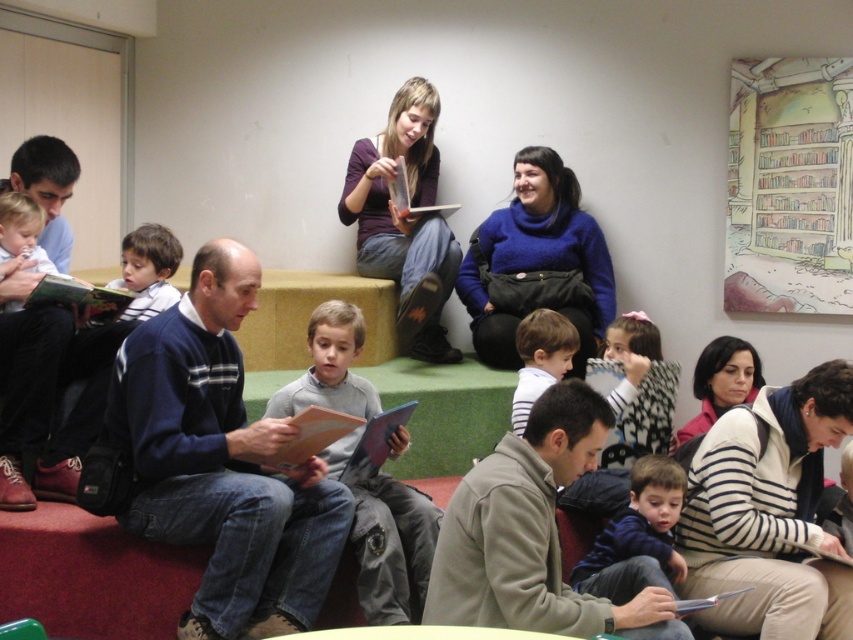
Question: Which is nearer to the blue striped sweater at center?

Choices:
 (A) white striped shirt at center
 (B) gray matte sweater at center
 (C) white striped sweater at lower right

Answer: (B)

Question: In this image, where is matte blue sweater at left located relative to dark blue sweater at lower center?

Choices:
 (A) left
 (B) right

Answer: (A)

Question: Which object is closer to the camera taking this photo?

Choices:
 (A) blue sweater at center
 (B) blue striped sweater at center

Answer: (A)

Question: From the image, what is the correct spatial relationship of blue sweater at center in relation to gray fleece jacket at lower right?

Choices:
 (A) above
 (B) below

Answer: (A)

Question: Which object is closer to the camera taking this photo?

Choices:
 (A) blue sweater at center
 (B) gray fleece jacket at lower right

Answer: (B)

Question: Is gray fleece jacket at lower right below blue striped sweater at center?

Choices:
 (A) yes
 (B) no

Answer: (A)